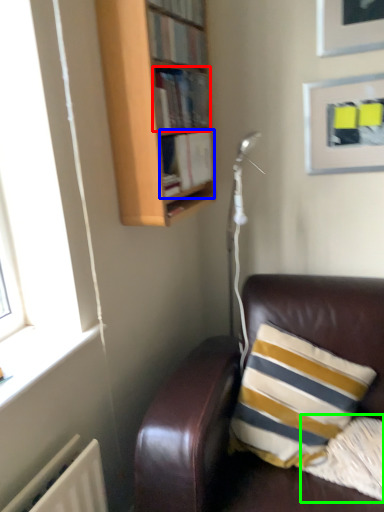
Question: Considering the real-world distances, which object is farthest from book (highlighted by a red box)? book (highlighted by a blue box) or pillow (highlighted by a green box)?

Choices:
 (A) book
 (B) pillow

Answer: (B)